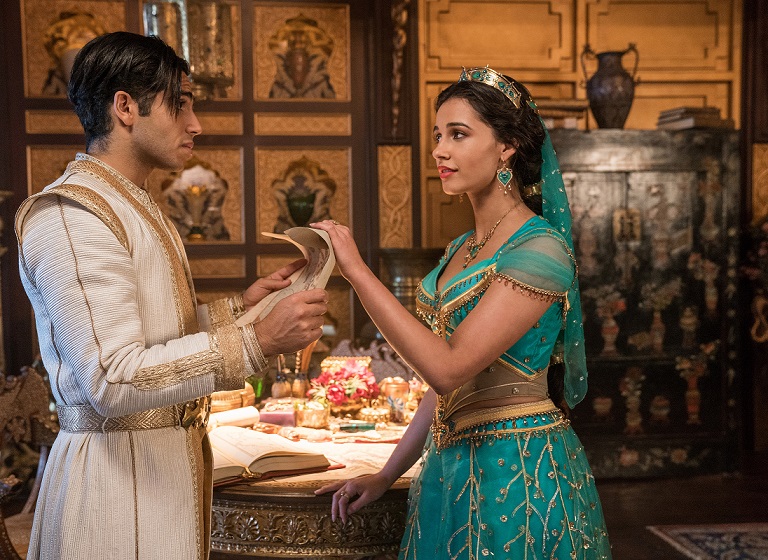
I want to click on corner of rug, so pos(700,541).